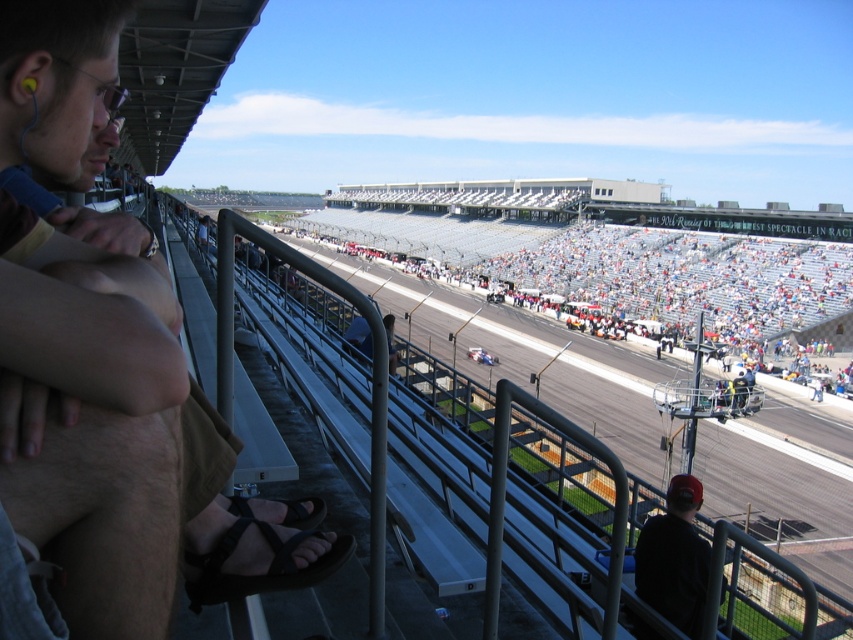
Which of these two, smooth asphalt race track at center or black synthetic sandal at lower left, stands taller?

smooth asphalt race track at center

Who is more distant from viewer, (479, 493) or (312, 502)?

The point (479, 493) is behind.

Locate an element on the screen. smooth asphalt race track at center is located at coordinates (556, 522).

Image resolution: width=853 pixels, height=640 pixels. Find the location of `smooth asphalt race track at center`. smooth asphalt race track at center is located at coordinates (556, 522).

Based on the photo, does smooth asphalt race track at center have a greater width compared to black fabric cap at lower right?

Correct, the width of smooth asphalt race track at center exceeds that of black fabric cap at lower right.

Can you confirm if smooth asphalt race track at center is thinner than black fabric cap at lower right?

No.

The width and height of the screenshot is (853, 640). I want to click on smooth asphalt race track at center, so click(556, 522).

Is matte black sandal at lower left positioned in front of black fabric cap at lower right?

Yes, it is.

I want to click on matte black sandal at lower left, so click(111, 433).

Identify the location of matte black sandal at lower left. The image size is (853, 640). (111, 433).

This screenshot has width=853, height=640. I want to click on matte black sandal at lower left, so click(x=111, y=433).